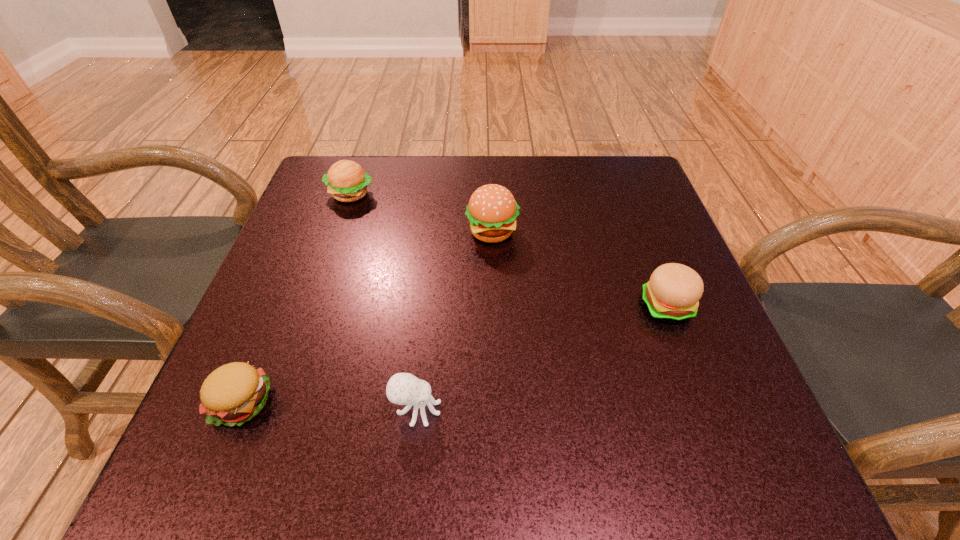
Where is `the tallest object`? the tallest object is located at coordinates tap(492, 210).

Find the location of `the third nearest hamburger`. the third nearest hamburger is located at coordinates (492, 210).

Locate an element on the screen. the farthest hamburger is located at coordinates (347, 182).

Identify the location of the rightmost object. This screenshot has width=960, height=540. (674, 290).

Where is `the second nearest hamburger`? The height and width of the screenshot is (540, 960). the second nearest hamburger is located at coordinates (674, 290).

At what (x,y) coordinates should I click in order to perform the action: click on octopus. Please return your answer as a coordinate pair (x, y). This screenshot has height=540, width=960. Looking at the image, I should click on (403, 388).

Identify the location of the nearest hamburger. This screenshot has height=540, width=960. (234, 393).

Where is `the shortest object`? The width and height of the screenshot is (960, 540). the shortest object is located at coordinates (234, 393).

This screenshot has height=540, width=960. Identify the location of vacant position located on the right of the tallest object. (666, 231).

Where is `free space located on the front of the farthest hamburger`? The image size is (960, 540). free space located on the front of the farthest hamburger is located at coordinates (303, 331).